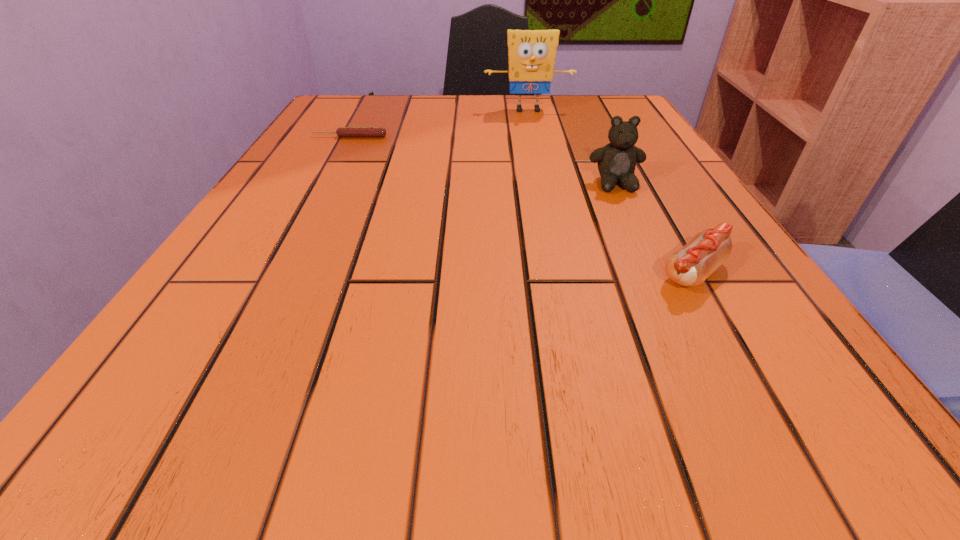
Locate an element on the screen. vacant space located 0.050m on the front of the taller sausage is located at coordinates (724, 327).

In order to click on free space located on the back of the farther sausage in this screenshot , I will do `click(365, 109)`.

Image resolution: width=960 pixels, height=540 pixels. I want to click on object at the far edge, so click(x=531, y=53).

Identify the location of object that is at the left edge. The image size is (960, 540). (342, 131).

Where is `sponge located in the right edge section of the desktop`? sponge located in the right edge section of the desktop is located at coordinates (531, 53).

Locate an element on the screen. This screenshot has width=960, height=540. teddy bear located at the right edge is located at coordinates (617, 160).

Where is `sausage situated at the right edge`? The image size is (960, 540). sausage situated at the right edge is located at coordinates (690, 266).

At what (x,y) coordinates should I click in order to perform the action: click on object that is at the far right corner. Please return your answer as a coordinate pair (x, y). The image size is (960, 540). Looking at the image, I should click on (531, 53).

In the image, there is a desktop. Identify the location of vacant space at the far edge. The image size is (960, 540). (x=469, y=100).

Where is `vacant space at the left edge of the desktop`? Image resolution: width=960 pixels, height=540 pixels. vacant space at the left edge of the desktop is located at coordinates (254, 285).